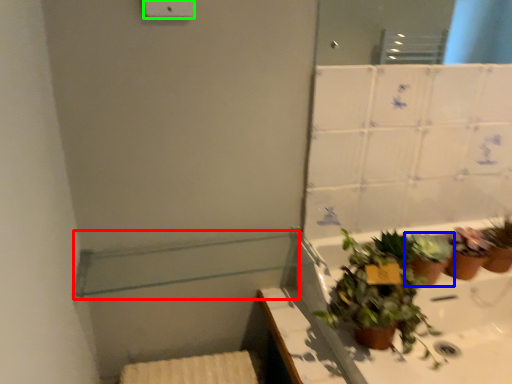
Question: Which is nearer to the balustrade (highlighted by a red box)? houseplant (highlighted by a blue box) or light switch (highlighted by a green box).

Choices:
 (A) houseplant
 (B) light switch

Answer: (A)